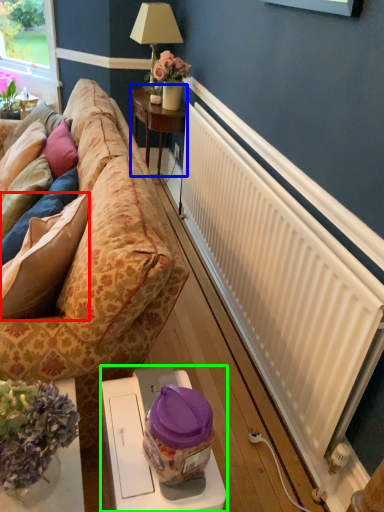
Question: Considering the real-world distances, which object is farthest from pillow (highlighted by a red box)? table (highlighted by a blue box) or table (highlighted by a green box)?

Choices:
 (A) table
 (B) table

Answer: (A)